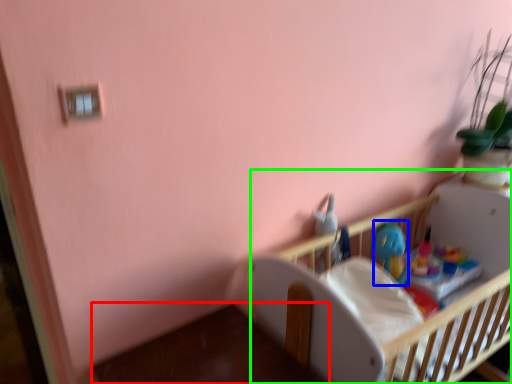
Question: Which object is positioned closest to table (highlighted by a red box)? Select from toy (highlighted by a blue box) and infant bed (highlighted by a green box).

Choices:
 (A) toy
 (B) infant bed

Answer: (B)